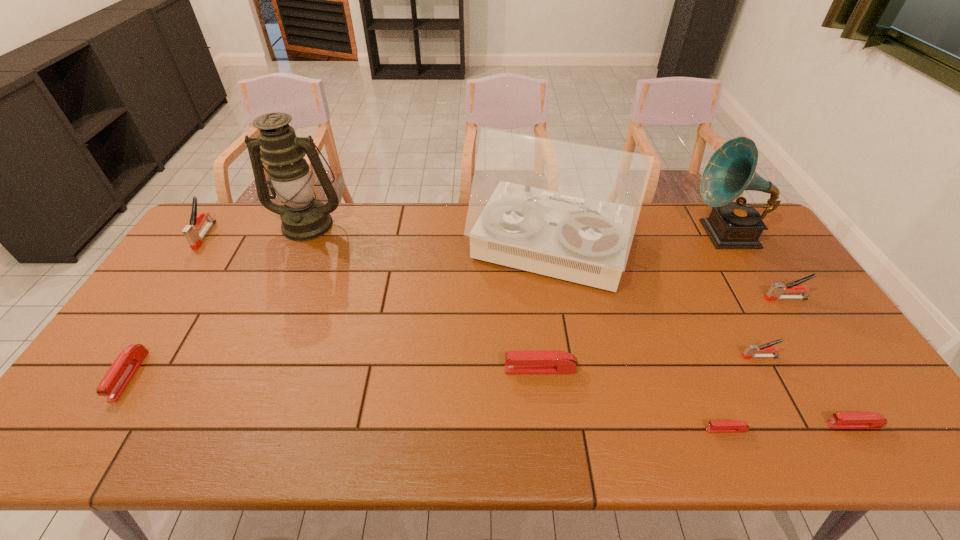
I want to click on vacant space located from the horn of the eighth shortest object, so click(668, 234).

This screenshot has height=540, width=960. Find the location of `blank space located 0.240m from the horn of the eighth shortest object`. blank space located 0.240m from the horn of the eighth shortest object is located at coordinates (618, 234).

This screenshot has height=540, width=960. In order to click on vacant point located 0.130m on the handle side of the farthest stapler in this screenshot , I will do `click(176, 278)`.

Where is `vacant space located 0.170m on the handle side of the sixth shortest object`? This screenshot has width=960, height=540. vacant space located 0.170m on the handle side of the sixth shortest object is located at coordinates (708, 299).

Identify the location of vacant area located 0.180m on the handle side of the sixth shortest object. This screenshot has height=540, width=960. (704, 299).

The height and width of the screenshot is (540, 960). I want to click on vacant space located on the handle side of the sixth shortest object, so click(x=690, y=299).

Where is `free space located on the handle side of the nearest gray stapler`? This screenshot has width=960, height=540. free space located on the handle side of the nearest gray stapler is located at coordinates (692, 357).

Where is `vacant position located on the handle side of the nearest gray stapler`? The width and height of the screenshot is (960, 540). vacant position located on the handle side of the nearest gray stapler is located at coordinates (711, 357).

This screenshot has height=540, width=960. Identify the location of vacant region located on the handle side of the nearest gray stapler. (692, 357).

The image size is (960, 540). What are the coordinates of `vacant space located 0.150m on the front-facing side of the fifth stapler from right to left` in the screenshot? It's located at (445, 369).